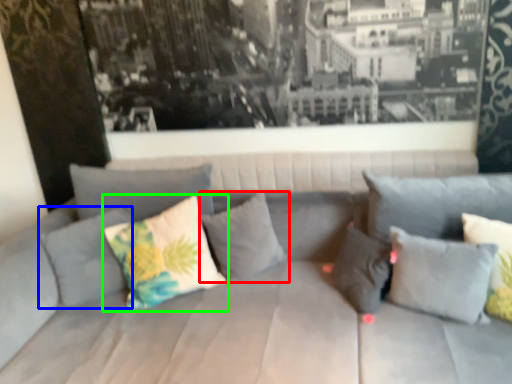
Question: Which is farther away from pillow (highlighted by a red box)? pillow (highlighted by a blue box) or pillow (highlighted by a green box)?

Choices:
 (A) pillow
 (B) pillow

Answer: (A)